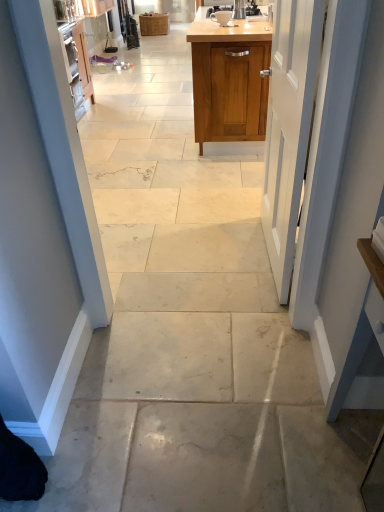
Question: From the image's perspective, is wooden cabinet at upper center, the 2th cabinetry viewed from the left, on wooden cabinet at center, placed as the 1th cabinetry when sorted from top to bottom?

Choices:
 (A) yes
 (B) no

Answer: (B)

Question: Is wooden cabinet at upper center, the 2th cabinetry viewed from the left, next to wooden cabinet at center, positioned as the 2th cabinetry in right-to-left order, and touching it?

Choices:
 (A) yes
 (B) no

Answer: (B)

Question: Is wooden cabinet at upper center, which is counted as the 2th cabinetry, starting from the back, oriented towards wooden cabinet at center, placed as the 1th cabinetry when sorted from top to bottom?

Choices:
 (A) yes
 (B) no

Answer: (B)

Question: Can you confirm if wooden cabinet at upper center, the first cabinetry positioned from the bottom, is shorter than wooden cabinet at center, which is counted as the 2th cabinetry, starting from the front?

Choices:
 (A) yes
 (B) no

Answer: (B)

Question: Is wooden cabinet at upper center, arranged as the 1th cabinetry when viewed from the right, surrounding wooden cabinet at center, the second cabinetry in the bottom-to-top sequence?

Choices:
 (A) yes
 (B) no

Answer: (B)

Question: Considering their positions, is wooden cabinet at center, positioned as the first cabinetry in left-to-right order, located in front of or behind matte ceramic coffee cup at upper center?

Choices:
 (A) behind
 (B) front

Answer: (A)

Question: From the image's perspective, is wooden cabinet at center, which is counted as the 2th cabinetry, starting from the front, above or below matte ceramic coffee cup at upper center?

Choices:
 (A) below
 (B) above

Answer: (B)

Question: From a real-world perspective, is wooden cabinet at center, positioned as the first cabinetry in left-to-right order, above or below matte ceramic coffee cup at upper center?

Choices:
 (A) above
 (B) below

Answer: (B)

Question: In terms of height, does wooden cabinet at center, positioned as the 2th cabinetry in right-to-left order, look taller or shorter compared to matte ceramic coffee cup at upper center?

Choices:
 (A) tall
 (B) short

Answer: (A)

Question: From a real-world perspective, relative to wooden cabinet at center, positioned as the first cabinetry in left-to-right order, is matte ceramic coffee cup at upper center vertically above or below?

Choices:
 (A) above
 (B) below

Answer: (A)

Question: Is matte ceramic coffee cup at upper center inside or outside of wooden cabinet at center, positioned as the 2th cabinetry in right-to-left order?

Choices:
 (A) inside
 (B) outside

Answer: (B)

Question: From the image's perspective, is matte ceramic coffee cup at upper center located above or below wooden cabinet at center, positioned as the 2th cabinetry in right-to-left order?

Choices:
 (A) below
 (B) above

Answer: (A)

Question: In terms of size, does matte ceramic coffee cup at upper center appear bigger or smaller than wooden cabinet at center, the first cabinetry when ordered from back to front?

Choices:
 (A) big
 (B) small

Answer: (B)

Question: In the image, is white painted wood door at center positioned in front of or behind wooden cabinet at upper center, the first cabinetry positioned from the bottom?

Choices:
 (A) behind
 (B) front

Answer: (B)

Question: In terms of height, does white painted wood door at center look taller or shorter compared to wooden cabinet at upper center, acting as the first cabinetry starting from the front?

Choices:
 (A) short
 (B) tall

Answer: (B)